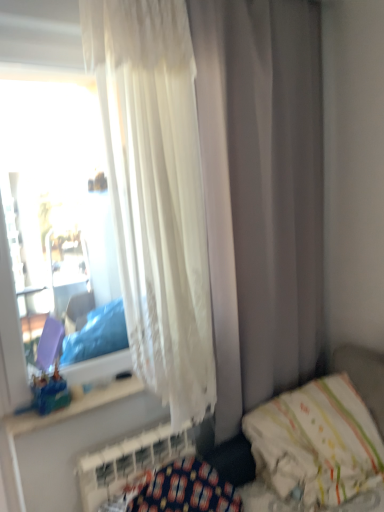
Question: Can you confirm if white textured radiator at lower left is shorter than white fabric hospital bed at lower right?

Choices:
 (A) yes
 (B) no

Answer: (A)

Question: From a real-world perspective, is white textured radiator at lower left over white fabric hospital bed at lower right?

Choices:
 (A) yes
 (B) no

Answer: (B)

Question: Does white textured radiator at lower left lie in front of white fabric hospital bed at lower right?

Choices:
 (A) no
 (B) yes

Answer: (A)

Question: Does white textured radiator at lower left appear on the right side of white fabric hospital bed at lower right?

Choices:
 (A) no
 (B) yes

Answer: (A)

Question: Considering the relative sizes of white textured radiator at lower left and white fabric hospital bed at lower right in the image provided, is white textured radiator at lower left thinner than white fabric hospital bed at lower right?

Choices:
 (A) yes
 (B) no

Answer: (A)

Question: Is white fabric hospital bed at lower right taller or shorter than translucent plastic toy at window?

Choices:
 (A) tall
 (B) short

Answer: (A)

Question: In terms of width, does white fabric hospital bed at lower right look wider or thinner when compared to translucent plastic toy at window?

Choices:
 (A) wide
 (B) thin

Answer: (A)

Question: From a real-world perspective, relative to translucent plastic toy at window, is white fabric hospital bed at lower right vertically above or below?

Choices:
 (A) below
 (B) above

Answer: (A)

Question: In terms of size, does white fabric hospital bed at lower right appear bigger or smaller than translucent plastic toy at window?

Choices:
 (A) small
 (B) big

Answer: (B)

Question: Choose the correct answer: Is translucent plastic toy at window inside white soft pillow at lower right or outside it?

Choices:
 (A) inside
 (B) outside

Answer: (B)

Question: Considering their positions, is translucent plastic toy at window located in front of or behind white soft pillow at lower right?

Choices:
 (A) behind
 (B) front

Answer: (A)

Question: Considering the positions of point (56, 400) and point (302, 415), is point (56, 400) closer or farther from the camera than point (302, 415)?

Choices:
 (A) farther
 (B) closer

Answer: (B)

Question: In terms of width, does translucent plastic toy at window look wider or thinner when compared to white soft pillow at lower right?

Choices:
 (A) thin
 (B) wide

Answer: (A)

Question: From a real-world perspective, is white textured radiator at lower left physically located above or below white soft pillow at lower right?

Choices:
 (A) above
 (B) below

Answer: (A)

Question: Is white textured radiator at lower left bigger or smaller than white soft pillow at lower right?

Choices:
 (A) big
 (B) small

Answer: (B)